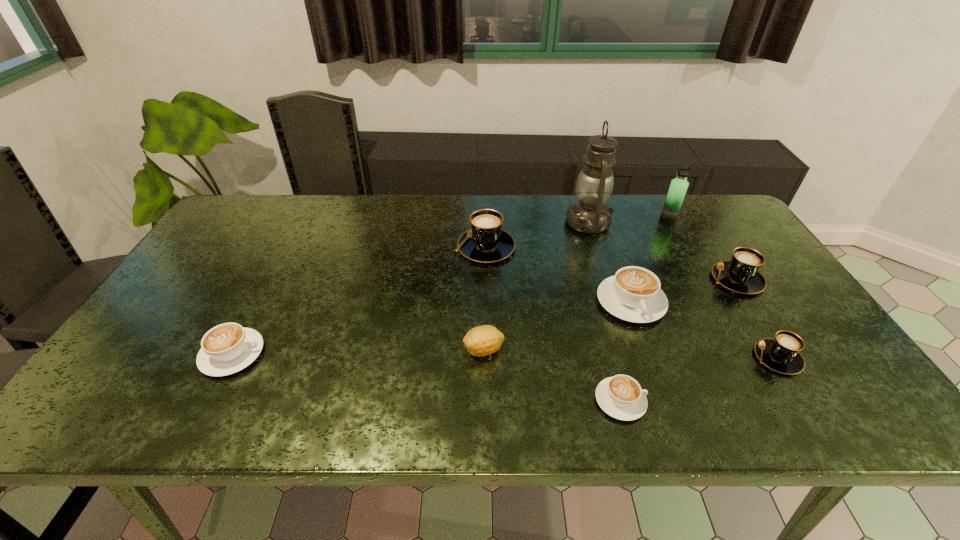
You are a GUI agent. You are given a task and a screenshot of the screen. Output one action in this format:
    pyautogui.click(x=<x>, y=<y>)
    Task: Click on the free spot between the lemon and the oil lamp
    The image size is (960, 540).
    Given the screenshot: What is the action you would take?
    pyautogui.click(x=537, y=286)

The image size is (960, 540). Identify the location of unoccupied area between the second biggest black cappuccino and the nearest black cappuccino. (756, 319).

Locate an element on the screen. free point between the biggest white cappuccino and the second smallest black cappuccino is located at coordinates (684, 291).

Find the location of a particular element. vacant area that lies between the smallest white cappuccino and the nearest black cappuccino is located at coordinates (699, 379).

The width and height of the screenshot is (960, 540). Find the location of `empty location between the leftmost cappuccino and the lemon`. empty location between the leftmost cappuccino and the lemon is located at coordinates (358, 352).

Identify the location of vacant space that is in between the farthest white cappuccino and the biggest black cappuccino. (558, 274).

At what (x,y) coordinates should I click in order to perform the action: click on vacant region between the eighth shortest object and the smallest black cappuccino. Please return your answer as a coordinate pair (x, y). This screenshot has height=540, width=960. Looking at the image, I should click on (723, 288).

This screenshot has width=960, height=540. What are the coordinates of `vacant space that is in between the second tallest object and the tallest object` in the screenshot? It's located at (629, 220).

Identify which object is the third closest to the leftmost cappuccino. Please provide its 2D coordinates. Your answer should be formatted as a tuple, i.e. [(x, y)], where the tuple contains the x and y coordinates of a point satisfying the conditions above.

[(621, 397)]

This screenshot has width=960, height=540. What are the coordinates of `the fourth closest object relative to the lemon` in the screenshot? It's located at (590, 215).